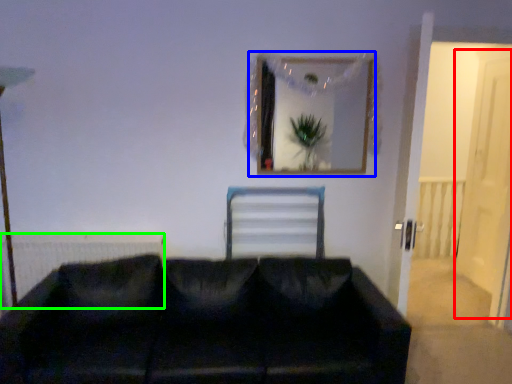
Question: Estimate the real-world distances between objects in this image. Which object is closer to glass door (highlighted by a red box), picture frame (highlighted by a blue box) or radiator (highlighted by a green box)?

Choices:
 (A) picture frame
 (B) radiator

Answer: (A)